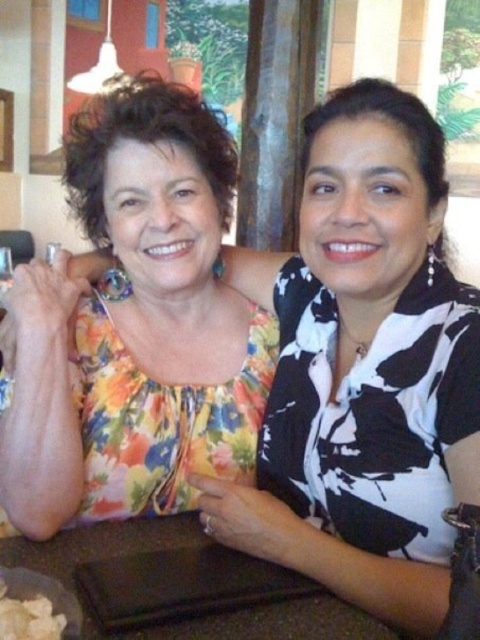
You are a photographer trying to capture a candid shot of the two women in the scene. The camera you are using has a maximum focus range of 30 inches. Can you focus on both the floral fabric blouse at upper left and the woman on the right simultaneously?

The two women are 32.32 inches apart, which exceeds the camera maximum focus range of 30 inches. Therefore, you cannot focus on both the floral fabric blouse at upper left and the woman on the right simultaneously.

You are trying to place a small vase on the table in the image. The table is represented by the point at coordinates point (x=264, y=624). If the vase is 10 cm in diameter, will it fit entirely on the table?

The table represented by point (x=264, y=624) has a diameter of 10 cm, so the vase will fit perfectly as it matches the table size.

You are standing in front of the two women at the casual dining setting. You notice two points marked on the image. The first point is at coordinates point (162,524) and the second point is at point (48,600). If you were to draw a straight line from your position to each point, which point would be closer to you?

Point (48,600) is closer to you because it is in front of point (162,524).